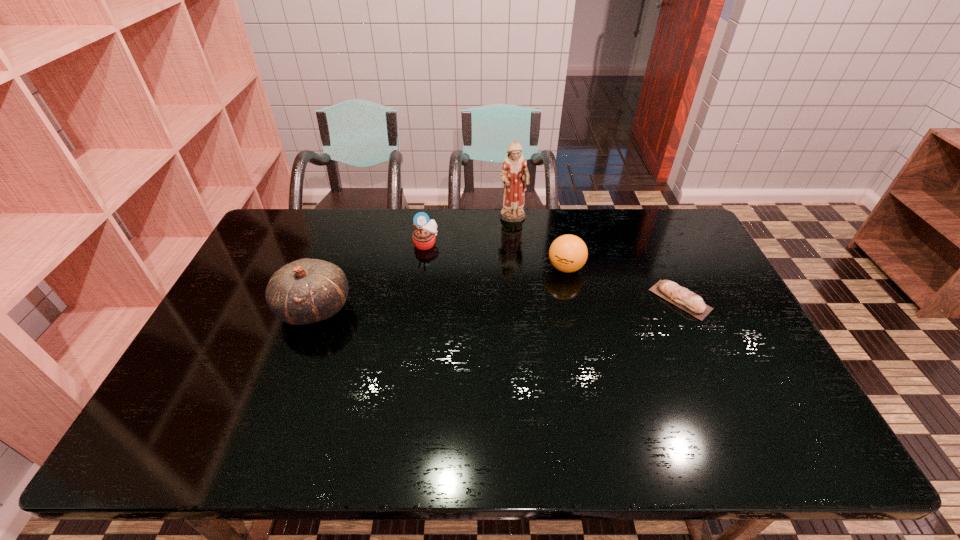
You are a GUI agent. You are given a task and a screenshot of the screen. Output one action in this format:
    pyautogui.click(x=<x>, y=<y>)
    Task: Click on the second closest object relative to the second object from right to left
    The height and width of the screenshot is (540, 960).
    Given the screenshot: What is the action you would take?
    pyautogui.click(x=688, y=301)

Locate an element on the screen. free spot that satisfies the following two spatial constraints: 1. on the back side of the gourd; 2. on the right side of the tallest object is located at coordinates (348, 219).

This screenshot has width=960, height=540. In order to click on free space in the image that satisfies the following two spatial constraints: 1. on the front side of the third object from left to right; 2. on the left side of the ping-pong ball in this screenshot , I will do `click(516, 268)`.

The image size is (960, 540). I want to click on vacant position in the image that satisfies the following two spatial constraints: 1. on the back side of the fourth object from right to left; 2. on the left side of the tallest object, so click(429, 219).